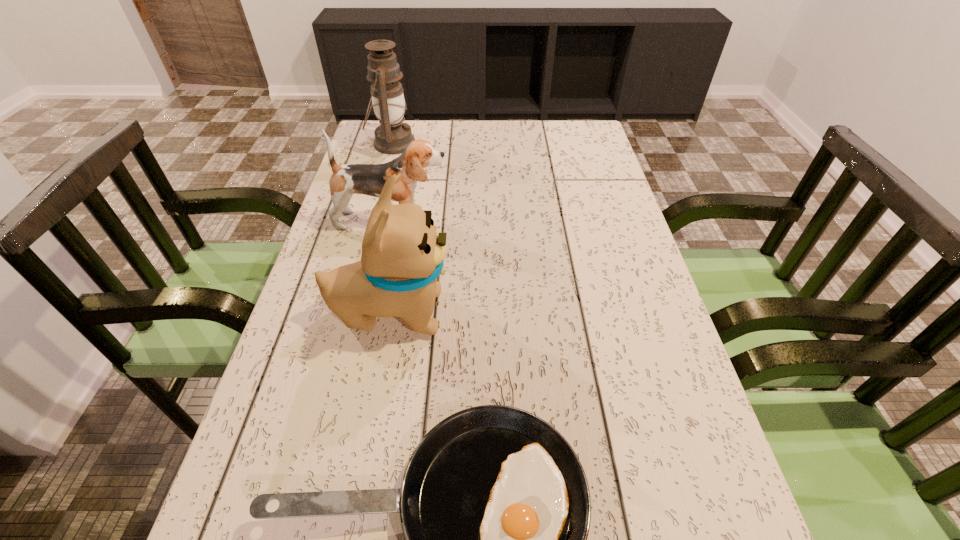
Where is `object at the far left corner`? The width and height of the screenshot is (960, 540). object at the far left corner is located at coordinates (393, 136).

In the image, there is a desktop. What are the coordinates of `vacant area at the far edge` in the screenshot? It's located at (536, 139).

In the image, there is a desktop. Identify the location of vacant space at the left edge. [344, 421].

In the image, there is a desktop. In order to click on free space at the right edge in this screenshot , I will do `click(649, 314)`.

The image size is (960, 540). In the image, there is a desktop. In order to click on free space at the far left corner in this screenshot , I will do `click(363, 138)`.

The image size is (960, 540). In order to click on free location at the far right corner in this screenshot , I will do 604,152.

Locate which object ranks second in proximity to the taller puppy. Please provide its 2D coordinates. Your answer should be formatted as a tuple, i.e. [(x, y)], where the tuple contains the x and y coordinates of a point satisfying the conditions above.

[(369, 179)]

Identify the location of object that stands as the third closest to the oil lamp. (495, 508).